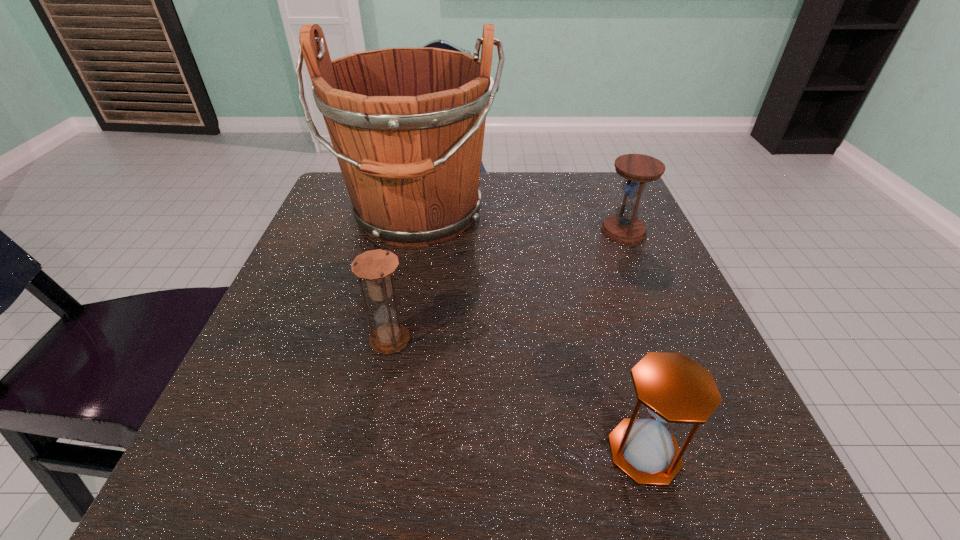
This screenshot has height=540, width=960. In order to click on unoccupied position between the rightmost object and the leftmost hourglass in this screenshot , I will do `click(507, 286)`.

The image size is (960, 540). Identify the location of free space between the third farthest object and the third object from left to right. (517, 396).

Locate which object is the third closest to the nearest hourglass. Please provide its 2D coordinates. Your answer should be formatted as a tuple, i.e. [(x, y)], where the tuple contains the x and y coordinates of a point satisfying the conditions above.

[(624, 227)]

Identify which object is the second nearest to the farthest hourglass. Please provide its 2D coordinates. Your answer should be formatted as a tuple, i.e. [(x, y)], where the tuple contains the x and y coordinates of a point satisfying the conditions above.

[(675, 389)]

Where is `hourglass that is the closest to the leftmost hourglass`? This screenshot has height=540, width=960. hourglass that is the closest to the leftmost hourglass is located at coordinates [675, 389].

Where is `hourglass object that ranks as the second closest to the third object from left to right`? The width and height of the screenshot is (960, 540). hourglass object that ranks as the second closest to the third object from left to right is located at coordinates (624, 227).

Find the location of a particular element. The image size is (960, 540). vacant position in the image that satisfies the following two spatial constraints: 1. with the handle on the side of the farthest hourglass; 2. on the left side of the bucket is located at coordinates (415, 231).

I want to click on vacant region that satisfies the following two spatial constraints: 1. with the handle on the side of the tallest object; 2. on the right side of the rightmost object, so click(415, 231).

Where is `free region that satisfies the following two spatial constraints: 1. with the handle on the side of the bucket; 2. on the left side of the second hourglass from right to left`? free region that satisfies the following two spatial constraints: 1. with the handle on the side of the bucket; 2. on the left side of the second hourglass from right to left is located at coordinates (372, 452).